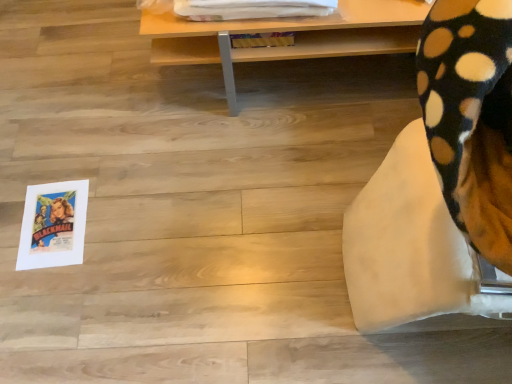
This screenshot has height=384, width=512. What do you see at coordinates (287, 30) in the screenshot?
I see `wooden table at upper center` at bounding box center [287, 30].

The width and height of the screenshot is (512, 384). Identify the location of wooden table at upper center. (287, 30).

In order to click on soft fleece blanket at lower right in this screenshot , I will do `click(415, 252)`.

Describe the element at coordinates (415, 252) in the screenshot. The image size is (512, 384). I see `soft fleece blanket at lower right` at that location.

What is the approximate width of soft fleece blanket at lower right?

The width of soft fleece blanket at lower right is 22.40 inches.

At what (x,y) coordinates should I click in order to perform the action: click on wooden table at upper center. Please return your answer as a coordinate pair (x, y). Looking at the image, I should click on (287, 30).

Is wooden table at upper center to the left or to the right of soft fleece blanket at lower right in the image?

Result: In the image, wooden table at upper center appears on the left side of soft fleece blanket at lower right.

Which object is further away from the camera taking this photo, wooden table at upper center or soft fleece blanket at lower right?

wooden table at upper center is more distant.

Is point (264, 31) more distant than point (508, 314)?

Yes, it is.

From the image's perspective, relative to soft fleece blanket at lower right, is wooden table at upper center above or below?

wooden table at upper center is above soft fleece blanket at lower right.

From a real-world perspective, between wooden table at upper center and soft fleece blanket at lower right, who is vertically lower?

wooden table at upper center.

Which object is thinner, wooden table at upper center or soft fleece blanket at lower right?

Thinner between the two is soft fleece blanket at lower right.

Which of these two, wooden table at upper center or soft fleece blanket at lower right, stands shorter?

With less height is wooden table at upper center.

In terms of size, does wooden table at upper center appear bigger or smaller than soft fleece blanket at lower right?

Clearly, wooden table at upper center is smaller in size than soft fleece blanket at lower right.

Choose the correct answer: Is wooden table at upper center inside soft fleece blanket at lower right or outside it?

wooden table at upper center is located beyond the bounds of soft fleece blanket at lower right.

Is wooden table at upper center next to soft fleece blanket at lower right and touching it?

No, wooden table at upper center is not in contact with soft fleece blanket at lower right.

Based on the photo, could you tell me if wooden table at upper center is facing soft fleece blanket at lower right?

No, wooden table at upper center does not turn towards soft fleece blanket at lower right.

Based on the photo, how many degrees apart are the facing directions of wooden table at upper center and soft fleece blanket at lower right?

0.000454 degrees separate the facing orientations of wooden table at upper center and soft fleece blanket at lower right.

How much distance is there between wooden table at upper center and soft fleece blanket at lower right?

68.57 centimeters.

Where is `table lying behind the soft fleece blanket at lower right`? The image size is (512, 384). table lying behind the soft fleece blanket at lower right is located at coordinates (287, 30).

Is soft fleece blanket at lower right to the right of wooden table at upper center from the viewer's perspective?

Yes.

Which object is further away from the camera taking this photo, soft fleece blanket at lower right or wooden table at upper center?

wooden table at upper center is further from the camera.

Which is in front, point (417, 251) or point (377, 12)?

The point (417, 251) is in front.

From the image's perspective, would you say soft fleece blanket at lower right is positioned over wooden table at upper center?

No, from the image's perspective, soft fleece blanket at lower right is not over wooden table at upper center.

From a real-world perspective, is soft fleece blanket at lower right located higher than wooden table at upper center?

Correct, in the physical world, soft fleece blanket at lower right is higher than wooden table at upper center.

Between soft fleece blanket at lower right and wooden table at upper center, which one has larger width?

wooden table at upper center is wider.

Does soft fleece blanket at lower right have a greater height compared to wooden table at upper center?

Yes.

In the scene shown: In terms of size, does soft fleece blanket at lower right appear bigger or smaller than wooden table at upper center?

Clearly, soft fleece blanket at lower right is larger in size than wooden table at upper center.

Can we say soft fleece blanket at lower right lies outside wooden table at upper center?

Yes, soft fleece blanket at lower right is outside of wooden table at upper center.

Is soft fleece blanket at lower right directly adjacent to wooden table at upper center?

soft fleece blanket at lower right and wooden table at upper center are not in contact.

Looking at this image, is soft fleece blanket at lower right turned away from wooden table at upper center?

No.

This screenshot has width=512, height=384. I want to click on table that appears behind the soft fleece blanket at lower right, so [287, 30].

At what (x,y) coordinates should I click in order to perform the action: click on furniture to the right of wooden table at upper center. Please return your answer as a coordinate pair (x, y). Looking at the image, I should click on pos(415,252).

You are a GUI agent. You are given a task and a screenshot of the screen. Output one action in this format:
    pyautogui.click(x=<x>, y=<y>)
    Task: Click on the furniture that appears below the wooden table at upper center (from the image's perspective)
    The height and width of the screenshot is (384, 512).
    Given the screenshot: What is the action you would take?
    pyautogui.click(x=415, y=252)